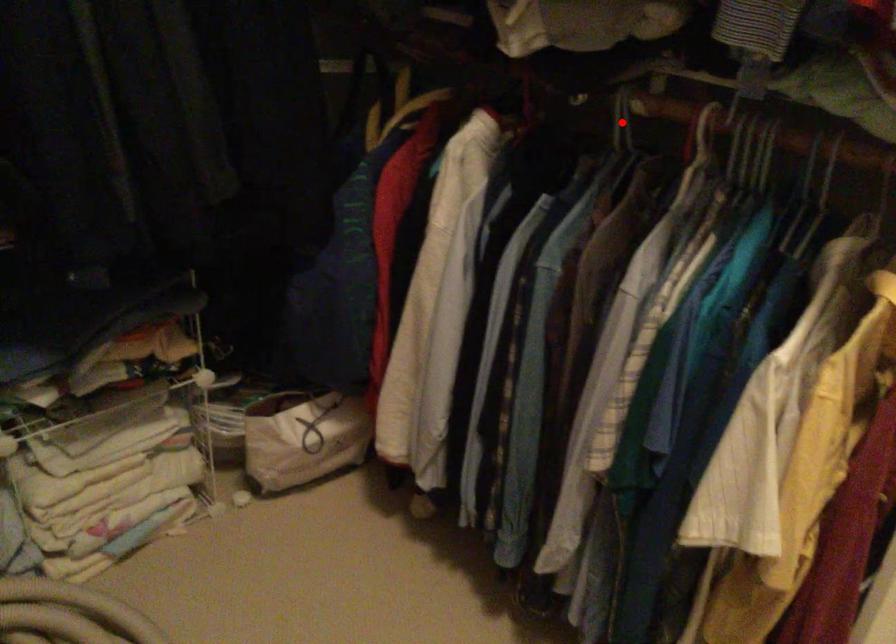
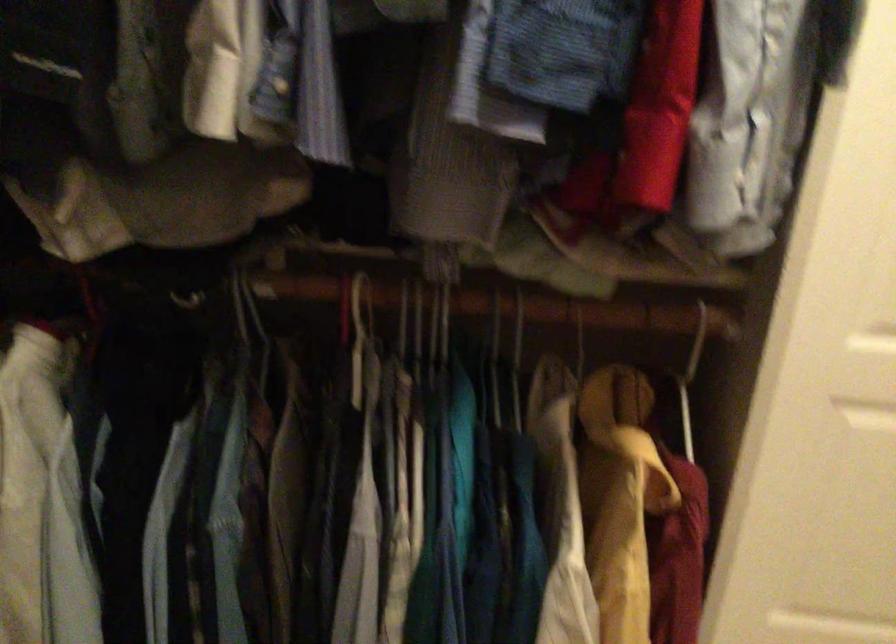
Locate, in the second image, the point that corresponds to the highlighted location in the first image.

(247, 307)